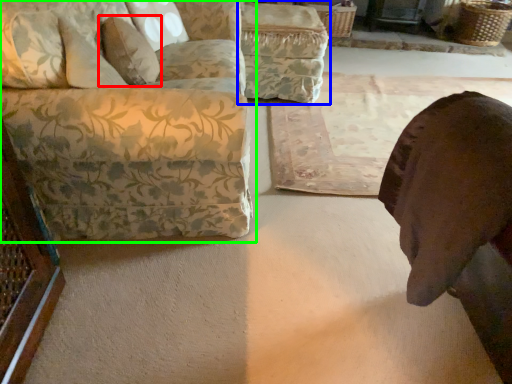
Question: Which object is positioned closest to pillow (highlighted by a red box)? Select from swivel chair (highlighted by a blue box) and studio couch (highlighted by a green box).

Choices:
 (A) swivel chair
 (B) studio couch

Answer: (B)